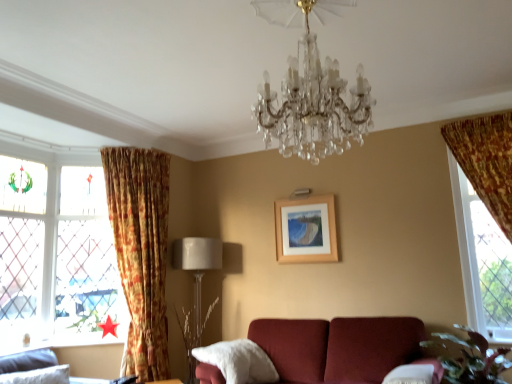
Question: In the image, is velvet gray sofa at lower left on the left side or the right side of beige fabric lampshade at lower left?

Choices:
 (A) left
 (B) right

Answer: (A)

Question: From a real-world perspective, relative to beige fabric lampshade at lower left, is velvet gray sofa at lower left vertically above or below?

Choices:
 (A) above
 (B) below

Answer: (B)

Question: Estimate the real-world distances between objects in this image. Which object is closer to the floral fabric curtain at left?

Choices:
 (A) velvet gray sofa at lower left
 (B) wooden frame at center
 (C) white fluffy pillow at lower center
 (D) clear glass window at right, marked as the first window in a front-to-back arrangement
 (E) stained glass window at left, which is counted as the second window, starting from the front

Answer: (E)

Question: Estimate the real-world distances between objects in this image. Which object is farther from the clear glass window at right, marked as the first window in a front-to-back arrangement?

Choices:
 (A) white fluffy pillow at lower center
 (B) velvet gray sofa at lower left
 (C) stained glass window at left, which is counted as the second window, starting from the front
 (D) floral fabric curtain at left
 (E) clear crystal chandelier at center

Answer: (C)